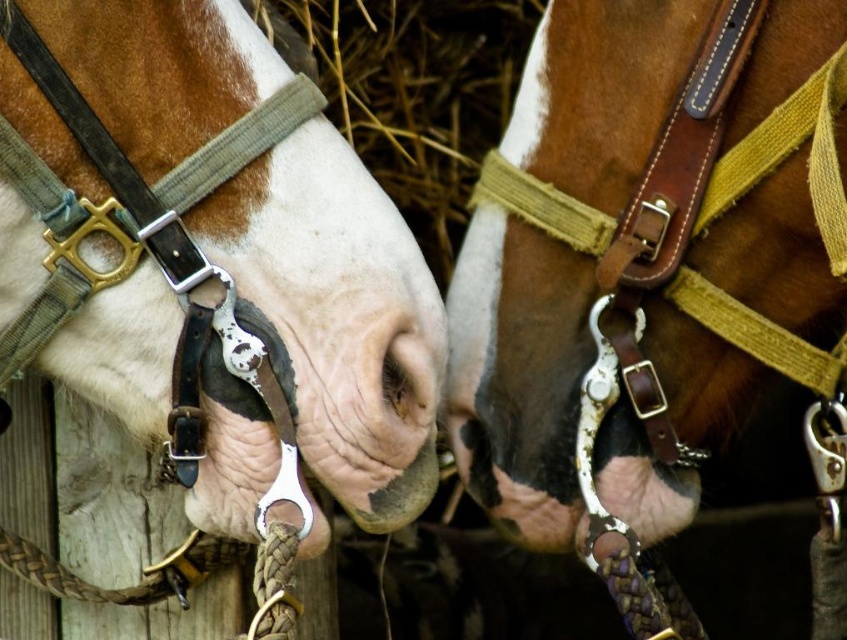
You are a veterinarian examining two horses. You notice a point at coordinates (209, 260). What is located at that point?

At point (209, 260) lies the matte black halter at left.

You are a horse trainer checking the equipment. You have a matte black halter at left and a brown leather halter at center. Which halter is smaller?

The matte black halter at left is smaller than the brown leather halter at center.

You are standing 1.27 meters away from the point marked at coordinates point [342,188]. If you want to take a photo of the two horses, will you be able to capture both of them in the frame without moving your position?

The point marked at coordinates point [342,188] is 1.27 meters away from you. Since the two horses are positioned side by side and their heads are overlapping partially, it is likely that you can capture both horses in the frame without moving your position as they are within the same general area.